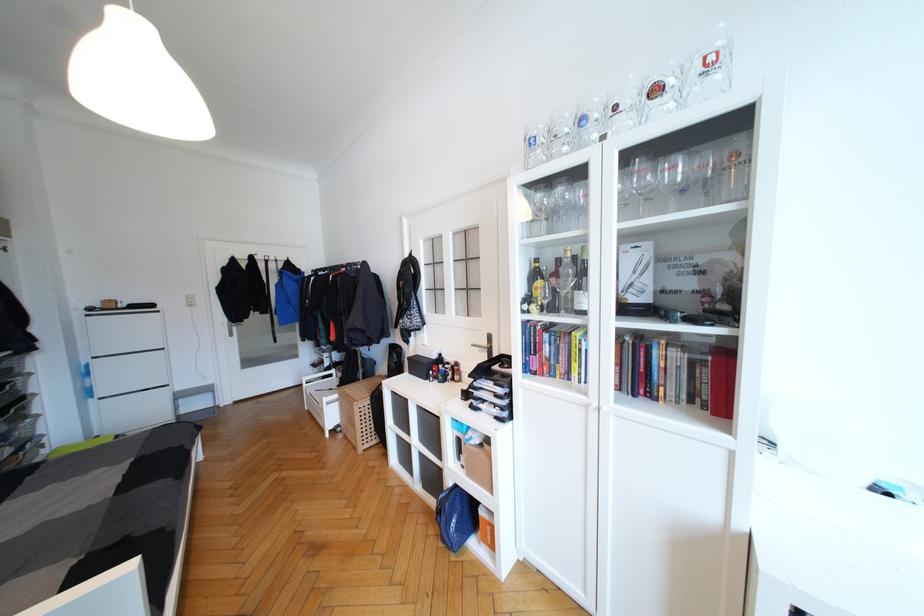
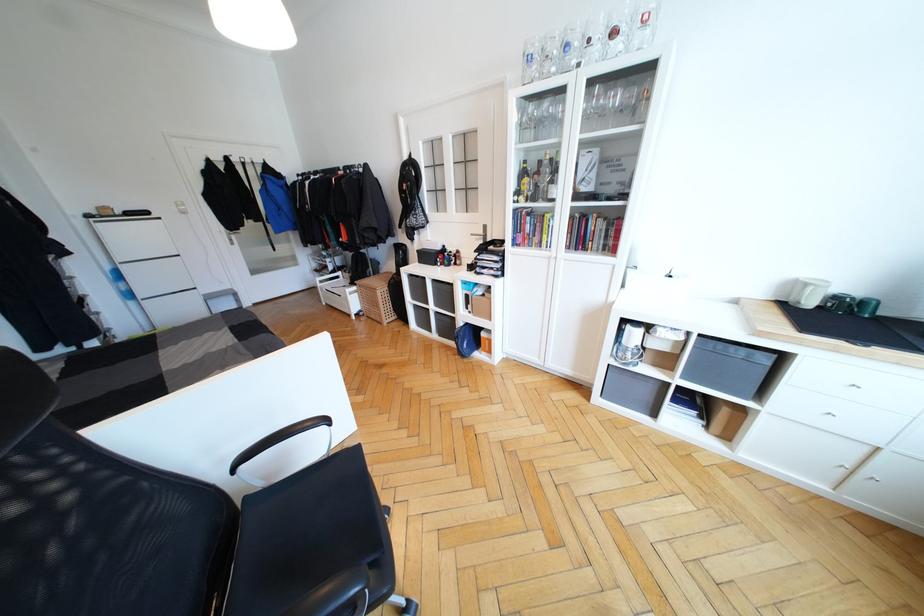
Question: The images are taken continuously from a first-person perspective. In which direction is your viewpoint rotating?

Choices:
 (A) Left
 (B) Right
 (C) Up
 (D) Down

Answer: (D)